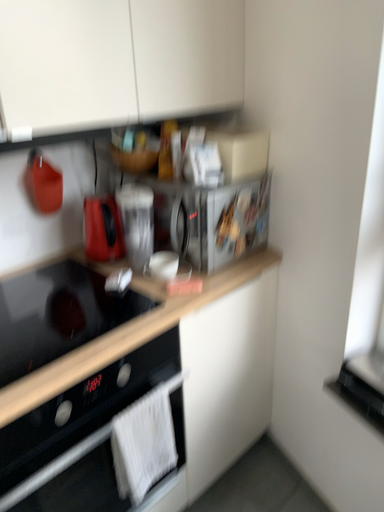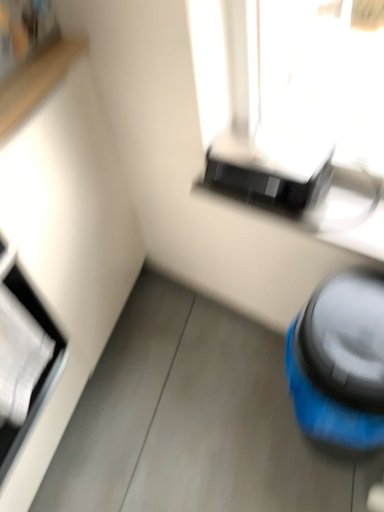
Question: How did the camera likely rotate when shooting the video?

Choices:
 (A) rotated upward
 (B) rotated downward

Answer: (B)